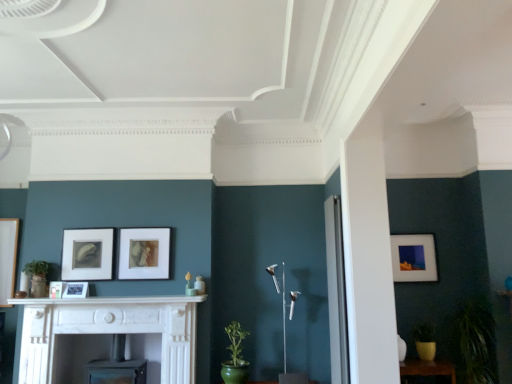
Question: Is matte white picture frame at right, positioned as the 1th picture frame in back-to-front order, completely or partially inside matte black picture frame at center, positioned as the first picture frame in left-to-right order?

Choices:
 (A) yes
 (B) no

Answer: (B)

Question: From the image's perspective, is matte black picture frame at center, placed as the 1th picture frame when sorted from front to back, under matte white picture frame at right, positioned as the 1th picture frame in back-to-front order?

Choices:
 (A) no
 (B) yes

Answer: (B)

Question: Is matte black picture frame at center, which ranks as the fifth picture frame in right-to-left order, located outside matte white picture frame at right, the fifth picture frame when ordered from front to back?

Choices:
 (A) no
 (B) yes

Answer: (B)

Question: Considering the relative positions of matte black picture frame at center, which ranks as the fifth picture frame in right-to-left order, and matte white picture frame at right, the fifth picture frame viewed from the left, in the image provided, is matte black picture frame at center, which ranks as the fifth picture frame in right-to-left order, to the left of matte white picture frame at right, the fifth picture frame viewed from the left, from the viewer's perspective?

Choices:
 (A) yes
 (B) no

Answer: (A)

Question: Does matte black picture frame at center, placed as the 1th picture frame when sorted from front to back, have a smaller size compared to matte white picture frame at right, the fifth picture frame viewed from the left?

Choices:
 (A) no
 (B) yes

Answer: (B)

Question: In terms of width, does white marble fireplace at lower left look wider or thinner when compared to green glazed pot at lower center, marked as the 2th plant in a right-to-left arrangement?

Choices:
 (A) wide
 (B) thin

Answer: (A)

Question: Considering their positions, is white marble fireplace at lower left located in front of or behind green glazed pot at lower center, marked as the 2th plant in a right-to-left arrangement?

Choices:
 (A) behind
 (B) front

Answer: (B)

Question: Does point tap(34, 340) appear closer or farther from the camera than point tap(230, 337)?

Choices:
 (A) farther
 (B) closer

Answer: (B)

Question: Looking at the image, does white marble fireplace at lower left seem bigger or smaller compared to green glazed pot at lower center, marked as the 2th plant in a right-to-left arrangement?

Choices:
 (A) big
 (B) small

Answer: (A)

Question: Is matte black picture frame at center, positioned as the first picture frame in left-to-right order, to the left or to the right of matte brown picture frame at center, which is the third picture frame in back-to-front order, in the image?

Choices:
 (A) left
 (B) right

Answer: (A)

Question: Looking at their shapes, would you say matte black picture frame at center, positioned as the first picture frame in left-to-right order, is wider or thinner than matte brown picture frame at center, placed as the 2th picture frame when sorted from right to left?

Choices:
 (A) thin
 (B) wide

Answer: (A)

Question: Is point (49, 288) positioned closer to the camera than point (132, 266)?

Choices:
 (A) closer
 (B) farther

Answer: (A)

Question: Looking at the image, does matte black picture frame at center, placed as the 1th picture frame when sorted from front to back, seem bigger or smaller compared to matte brown picture frame at center, placed as the 2th picture frame when sorted from right to left?

Choices:
 (A) big
 (B) small

Answer: (B)

Question: Considering their positions, is white marble fireplace at lower left located in front of or behind matte black picture frame at center left, positioned as the 4th picture frame in front-to-back order?

Choices:
 (A) front
 (B) behind

Answer: (A)

Question: Would you say white marble fireplace at lower left is to the left or to the right of matte black picture frame at center left, positioned as the 4th picture frame in front-to-back order, in the picture?

Choices:
 (A) left
 (B) right

Answer: (B)